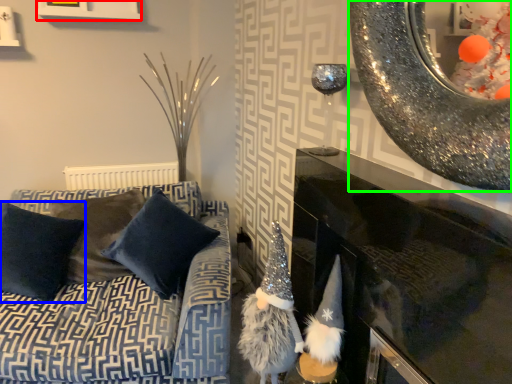
Question: Based on their relative distances, which object is nearer to picture frame (highlighted by a red box)? Choose from pillow (highlighted by a blue box) and oval (highlighted by a green box).

Choices:
 (A) pillow
 (B) oval

Answer: (A)